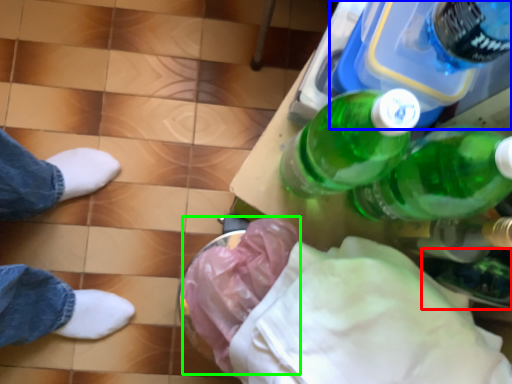
Question: Which is nearer to the glass bottle (highlighted by a red box)? bottle (highlighted by a blue box) or material (highlighted by a green box).

Choices:
 (A) bottle
 (B) material

Answer: (A)